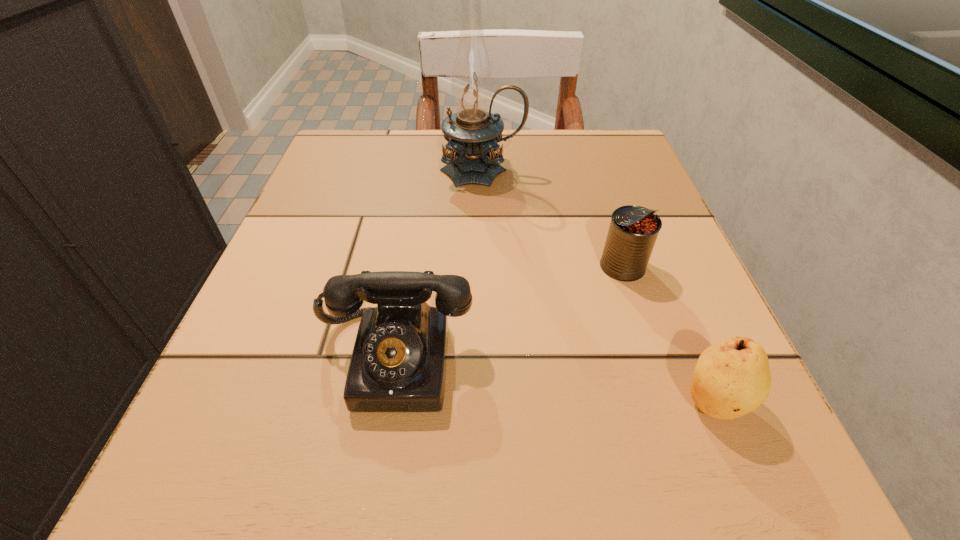
The height and width of the screenshot is (540, 960). Find the location of `the tallest object`. the tallest object is located at coordinates (473, 133).

The width and height of the screenshot is (960, 540). In order to click on oil lamp in this screenshot , I will do `click(473, 133)`.

Where is `telephone`? The width and height of the screenshot is (960, 540). telephone is located at coordinates (398, 364).

Locate an element on the screen. The height and width of the screenshot is (540, 960). the second farthest object is located at coordinates (633, 231).

Locate an element on the screen. pear is located at coordinates click(732, 378).

Where is `vacant space located on the front of the oil lamp`? This screenshot has height=540, width=960. vacant space located on the front of the oil lamp is located at coordinates (483, 261).

The height and width of the screenshot is (540, 960). Find the location of `free location located 0.070m on the dial of the telephone`. free location located 0.070m on the dial of the telephone is located at coordinates (375, 476).

Where is `free spot located 0.170m on the left of the can`? free spot located 0.170m on the left of the can is located at coordinates (493, 266).

Identify the location of free region located 0.250m on the back of the pear. (649, 244).

Where is `object that is positioned at the far edge`? object that is positioned at the far edge is located at coordinates (473, 133).